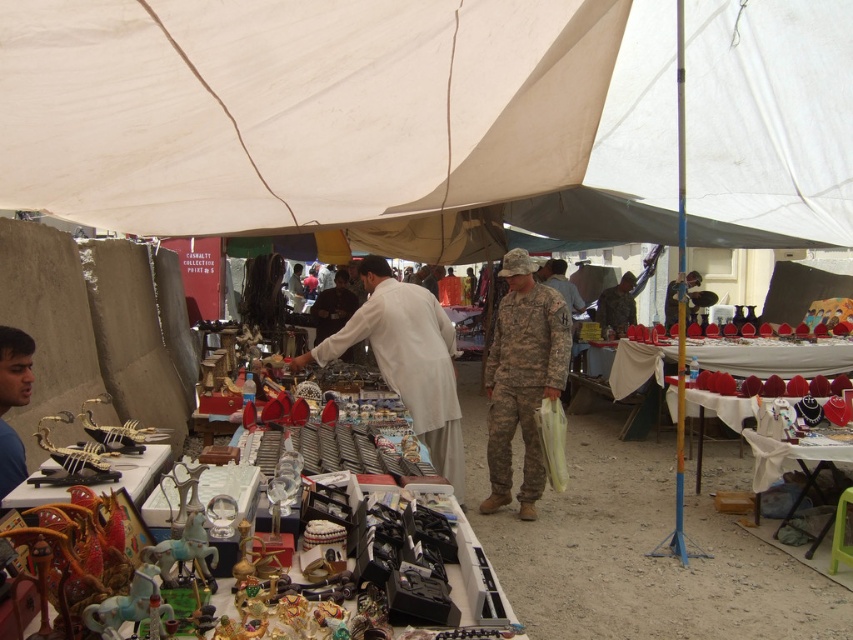
Question: Which object is positioned farthest from the camouflage uniform at center?

Choices:
 (A) white fabric canopy at upper center
 (B) white matte clothing at center

Answer: (A)

Question: Is white matte clothing at center closer to camera compared to camouflage uniform at center?

Choices:
 (A) yes
 (B) no

Answer: (A)

Question: Does white fabric canopy at upper center appear under white matte clothing at center?

Choices:
 (A) yes
 (B) no

Answer: (B)

Question: Among these points, which one is nearest to the camera?

Choices:
 (A) (828, 195)
 (B) (508, 422)

Answer: (B)

Question: Is white matte clothing at center to the left of camouflage uniform at center from the viewer's perspective?

Choices:
 (A) no
 (B) yes

Answer: (B)

Question: Based on their relative distances, which object is nearer to the white fabric canopy at upper center?

Choices:
 (A) white matte clothing at center
 (B) camouflage uniform at center

Answer: (A)